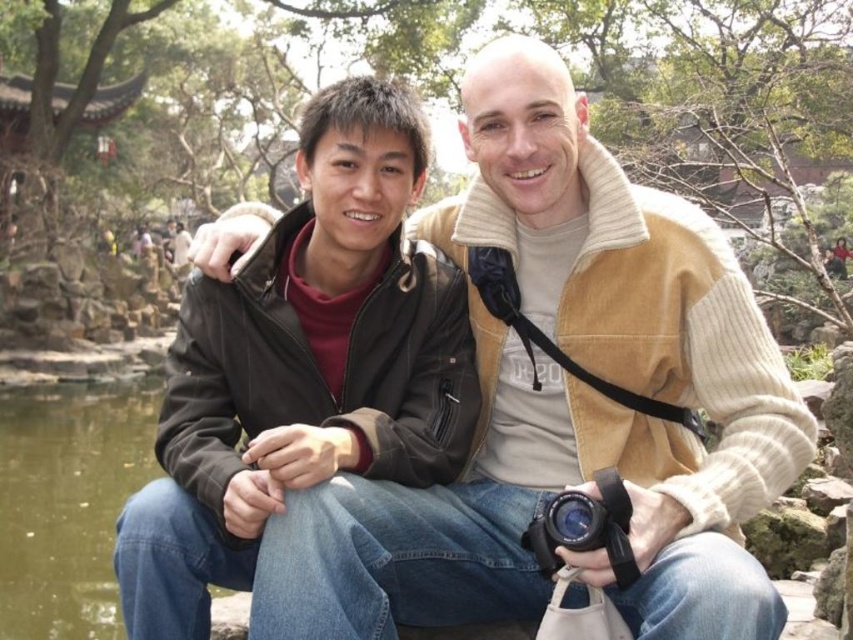
You are a photographer trying to capture the scene of the two people sitting on the stone ledge. You have a black rubber camera at lower center. To get a clear shot of the greenish water at lower left, should you zoom in or zoom out?

The greenish water at lower left is larger in size than the black rubber camera at lower center. Since the water is larger, you should zoom out to include more of the scene and capture the larger greenish water area in the frame.

You are standing at the camera position and want to throw a small ball to the matte black jacket at left. Is the distance too far for a typical adult to throw a ball that far?

The distance between the matte black jacket at left and the camera is 67.80 feet. A typical adult can throw a ball about 120 feet, so yes, the distance is manageable.

You are a photographer trying to capture a shot of the two people sitting on the stone ledge. You want to position yourself so that the matte black jacket at center and the greenish water at lower left are both in the frame. Based on their positions, which object should you place closer to the edge of your camera frame to ensure both are visible?

Since the matte black jacket at center is to the right of the greenish water at lower left, you should position the greenish water at lower left closer to the left edge of the frame and the matte black jacket at center closer to the right edge to include both in the shot.